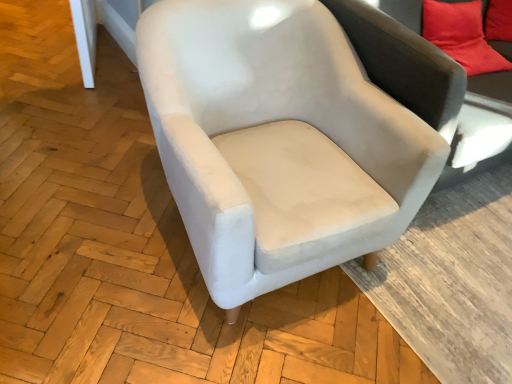
Question: From the image's perspective, is velvet-like gray couch at upper right located above velvet red pillow at upper right?

Choices:
 (A) no
 (B) yes

Answer: (A)

Question: Does velvet-like gray couch at upper right have a greater height compared to velvet red pillow at upper right?

Choices:
 (A) yes
 (B) no

Answer: (A)

Question: Are velvet-like gray couch at upper right and velvet red pillow at upper right far apart?

Choices:
 (A) yes
 (B) no

Answer: (B)

Question: Considering the relative positions of velvet-like gray couch at upper right and velvet red pillow at upper right in the image provided, is velvet-like gray couch at upper right to the right of velvet red pillow at upper right from the viewer's perspective?

Choices:
 (A) no
 (B) yes

Answer: (A)

Question: Is velvet-like gray couch at upper right smaller than velvet red pillow at upper right?

Choices:
 (A) no
 (B) yes

Answer: (A)

Question: Can you confirm if velvet-like gray couch at upper right is thinner than velvet red pillow at upper right?

Choices:
 (A) no
 (B) yes

Answer: (A)

Question: Considering the relative sizes of velvet beige swivel chair at center and velvet-like gray couch at upper right in the image provided, is velvet beige swivel chair at center shorter than velvet-like gray couch at upper right?

Choices:
 (A) yes
 (B) no

Answer: (B)

Question: Does velvet beige swivel chair at center appear on the left side of velvet-like gray couch at upper right?

Choices:
 (A) no
 (B) yes

Answer: (A)

Question: Considering the relative sizes of velvet beige swivel chair at center and velvet-like gray couch at upper right in the image provided, is velvet beige swivel chair at center bigger than velvet-like gray couch at upper right?

Choices:
 (A) no
 (B) yes

Answer: (B)

Question: Considering the relative sizes of velvet beige swivel chair at center and velvet-like gray couch at upper right in the image provided, is velvet beige swivel chair at center thinner than velvet-like gray couch at upper right?

Choices:
 (A) yes
 (B) no

Answer: (B)

Question: Is velvet beige swivel chair at center in contact with velvet-like gray couch at upper right?

Choices:
 (A) no
 (B) yes

Answer: (A)

Question: Is velvet beige swivel chair at center positioned before velvet-like gray couch at upper right?

Choices:
 (A) no
 (B) yes

Answer: (B)

Question: From a real-world perspective, is velvet-like gray couch at upper right under velvet beige swivel chair at center?

Choices:
 (A) no
 (B) yes

Answer: (A)